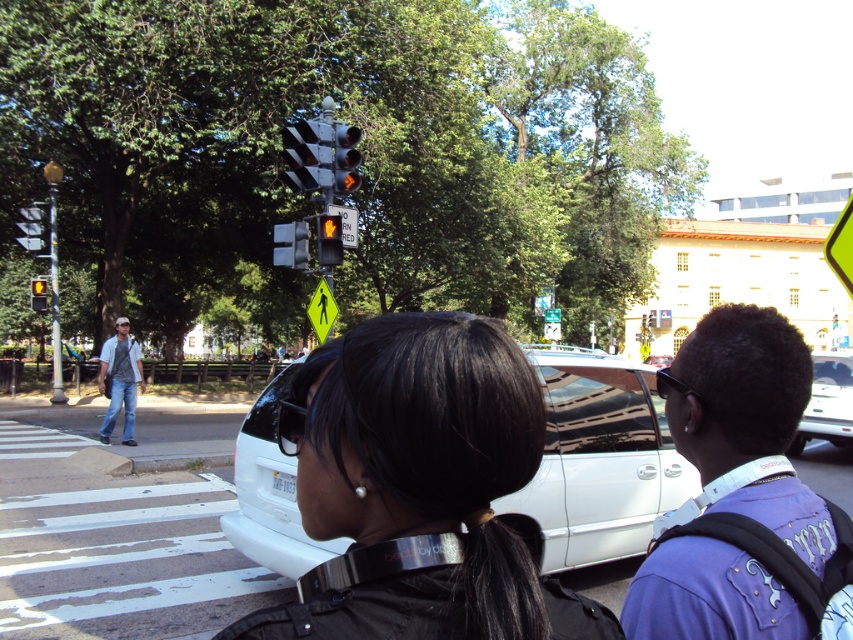
Which of these two, purple fabric shirt at center right or yellow reflective pedestrian crossing sign at upper center, stands shorter?

With less height is yellow reflective pedestrian crossing sign at upper center.

Who is more distant from viewer, (x=799, y=621) or (x=548, y=321)?

The point (x=548, y=321) is more distant.

Who is more forward, (x=792, y=611) or (x=549, y=310)?

Point (x=792, y=611) is more forward.

This screenshot has height=640, width=853. In order to click on purple fabric shirt at center right in this screenshot , I will do `click(741, 497)`.

Is white matte van at center positioned behind metallic orange traffic light at upper center?

Yes, white matte van at center is further from the viewer.

Is white matte van at center bigger than metallic orange traffic light at upper center?

Yes.

Is point (846, 442) behind point (335, 177)?

Yes, it is behind point (335, 177).

Find the location of `white matte van at center`. white matte van at center is located at coordinates (827, 403).

Consider the image. Does black matte hair at center have a greater height compared to denim jeans at left?

Indeed, black matte hair at center has a greater height compared to denim jeans at left.

Is point (474, 372) closer to camera compared to point (120, 348)?

Yes, point (474, 372) is closer to viewer.

The width and height of the screenshot is (853, 640). Identify the location of black matte hair at center. (419, 490).